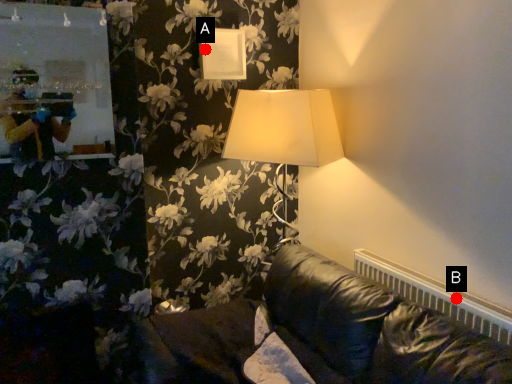
Question: Two points are circled on the image, labeled by A and B beside each circle. Among these points, which one is farthest from the camera?

Choices:
 (A) A is further
 (B) B is further

Answer: (A)